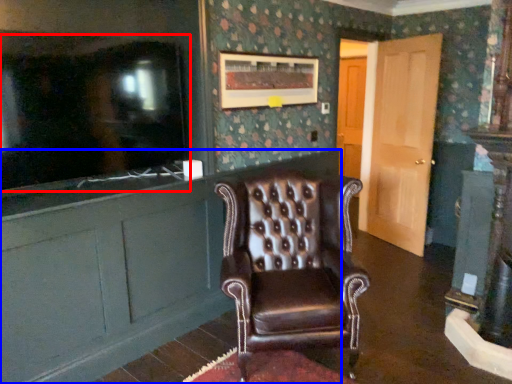
Question: Which of the following is the farthest to the observer, tv show (highlighted by a red box) or cabinetry (highlighted by a blue box)?

Choices:
 (A) tv show
 (B) cabinetry

Answer: (B)